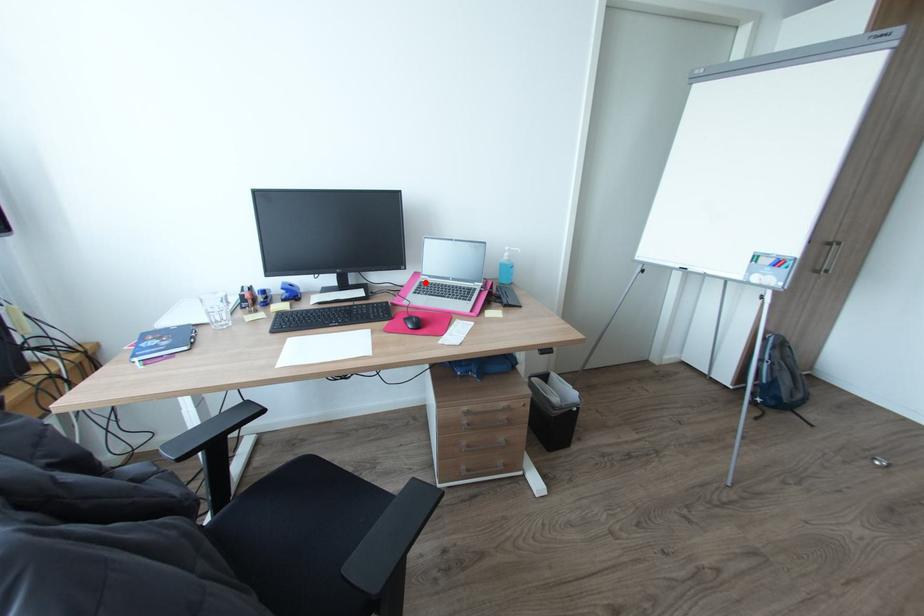
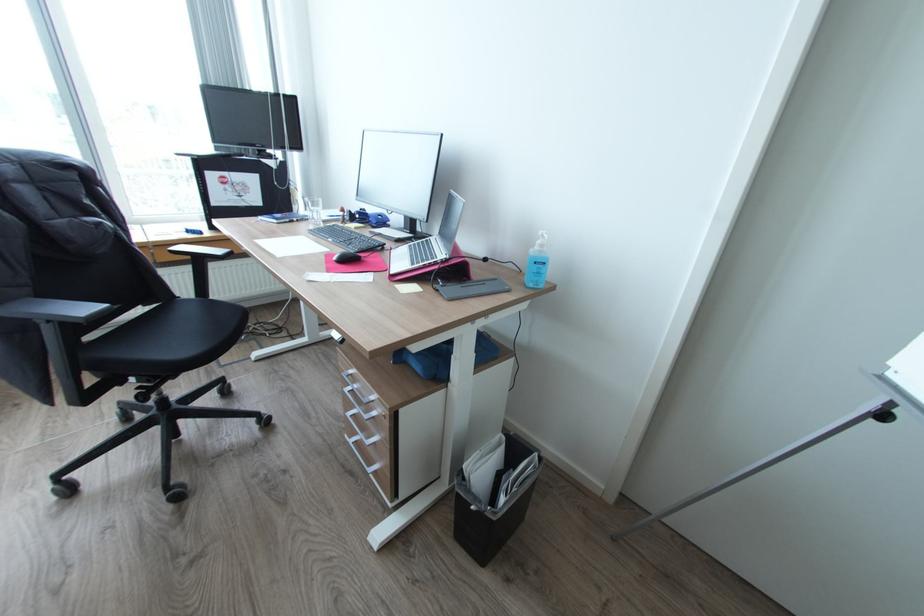
Locate, in the second image, the point that corresponds to the highlighted location in the first image.

(432, 238)